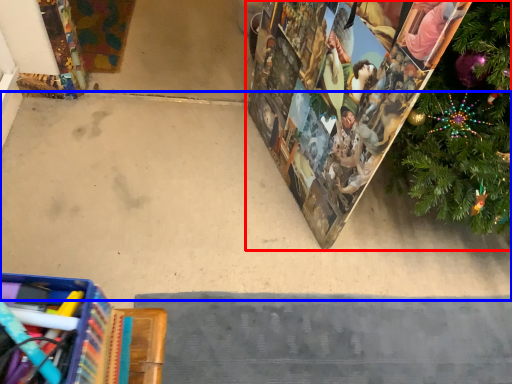
Question: Which object appears closest to the camera in this image, christmas decoration (highlighted by a red box) or concrete (highlighted by a blue box)?

Choices:
 (A) christmas decoration
 (B) concrete

Answer: (A)